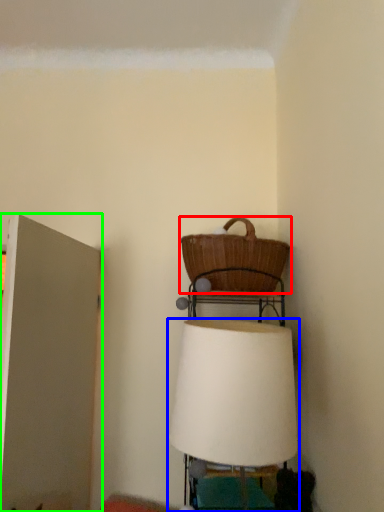
Question: Which is farther away from picnic basket (highlighted by a red box)? lamp (highlighted by a blue box) or door (highlighted by a green box)?

Choices:
 (A) lamp
 (B) door

Answer: (B)